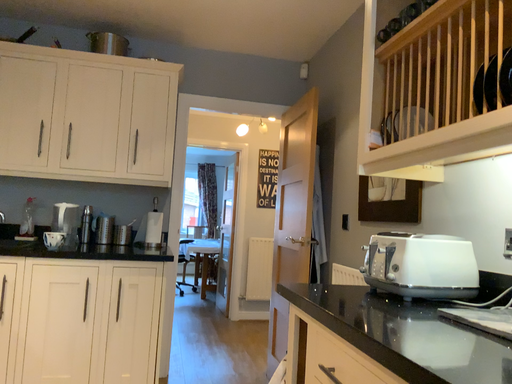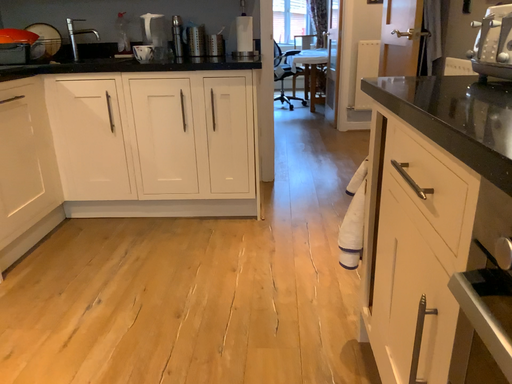
Question: How did the camera likely rotate when shooting the video?

Choices:
 (A) rotated upward
 (B) rotated downward

Answer: (B)